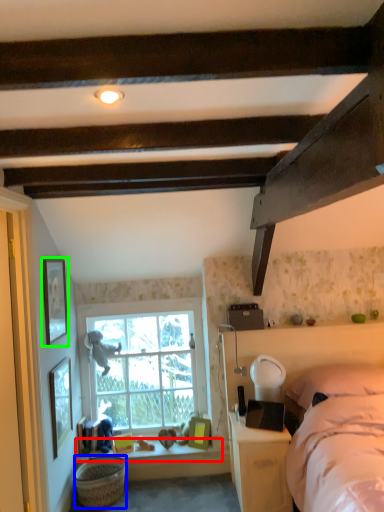
Question: Which object is the farthest from window sill (highlighted by a red box)? Choose among these: basket (highlighted by a blue box) or picture frame (highlighted by a green box).

Choices:
 (A) basket
 (B) picture frame

Answer: (B)